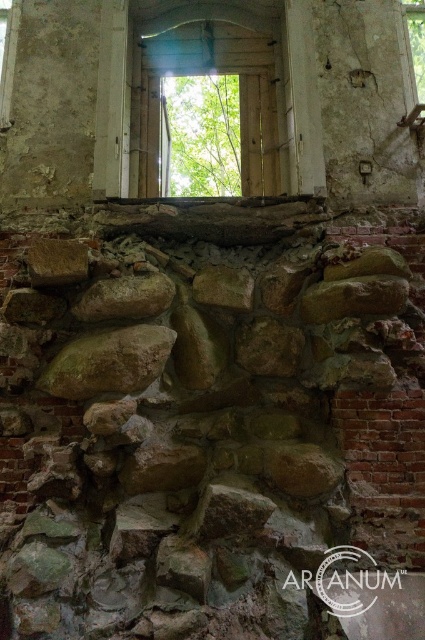
Question: Estimate the real-world distances between objects in this image. Which object is closer to the green rough stone at center?

Choices:
 (A) transparent wooden door at upper center
 (B) brown rough stone at center

Answer: (B)

Question: Which point is closer to the camera taking this photo?

Choices:
 (A) (133, 164)
 (B) (122, 278)

Answer: (B)

Question: Which is nearer to the brown rough stone at center?

Choices:
 (A) green rough stone at center
 (B) transparent wooden door at upper center

Answer: (A)

Question: Does transparent wooden door at upper center appear on the left side of brown rough stone at center?

Choices:
 (A) no
 (B) yes

Answer: (A)

Question: Can you confirm if transparent wooden door at upper center is positioned above green rough stone at center?

Choices:
 (A) no
 (B) yes

Answer: (B)

Question: Does transparent wooden door at upper center appear on the right side of green rough stone at center?

Choices:
 (A) yes
 (B) no

Answer: (A)